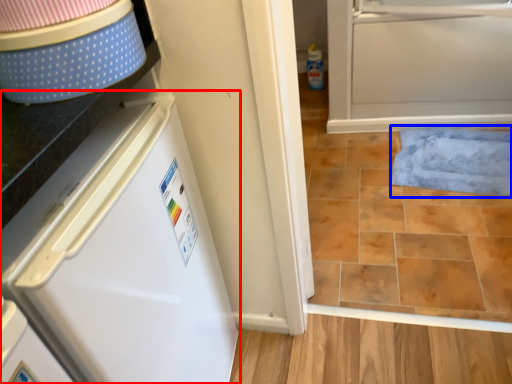
Question: Which object is closer to the camera taking this photo, refrigerator (highlighted by a red box) or bath mat (highlighted by a blue box)?

Choices:
 (A) refrigerator
 (B) bath mat

Answer: (A)